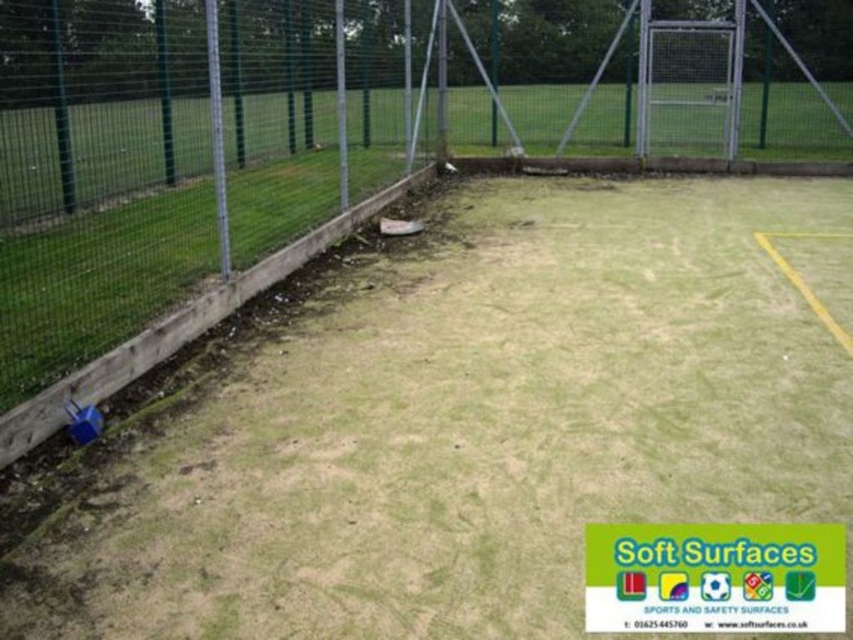
Consider the image. Which is more to the right, green grass at center or green wire mesh fence at upper left?

green grass at center

Does point (491, 198) come farther from viewer compared to point (264, 19)?

No.

Is point (173, 522) closer to viewer compared to point (523, 108)?

Yes, point (173, 522) is closer to viewer.

At what (x,y) coordinates should I click in order to perform the action: click on green grass at center. Please return your answer as a coordinate pair (x, y). This screenshot has height=640, width=853. Looking at the image, I should click on (456, 426).